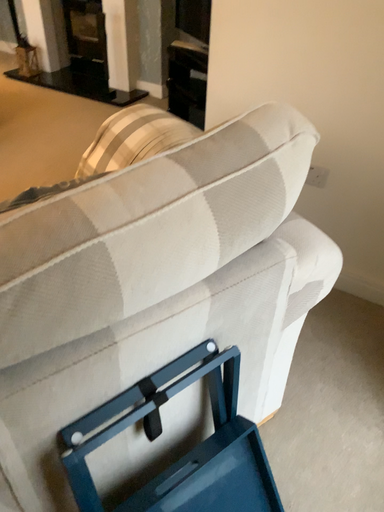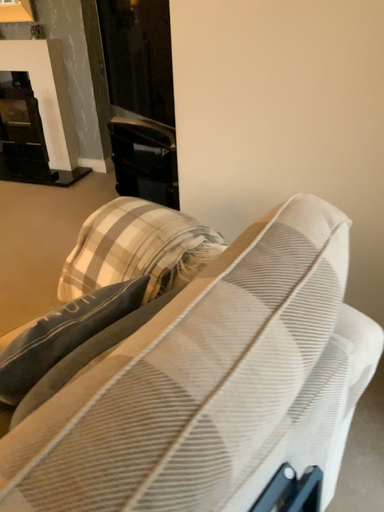
Question: How did the camera likely rotate when shooting the video?

Choices:
 (A) rotated upward
 (B) rotated downward

Answer: (A)